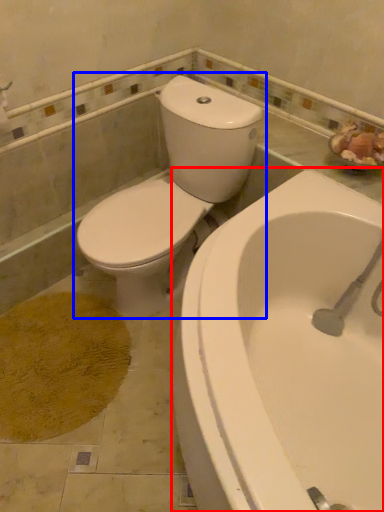
Question: Which of the following is the closest to the observer, bathtub (highlighted by a red box) or toilet (highlighted by a blue box)?

Choices:
 (A) bathtub
 (B) toilet

Answer: (A)